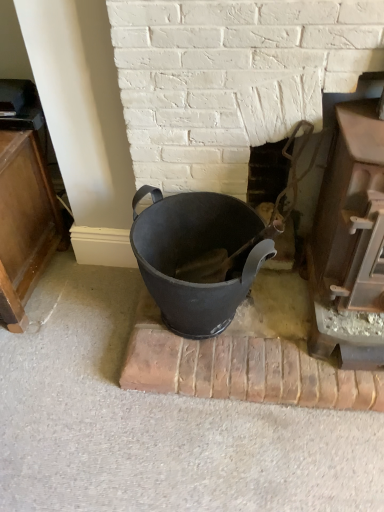
Question: Is smooth metal fireplace at center, marked as the second fireplace in a right-to-left arrangement, facing towards smooth brown wood at right, the 1th fireplace positioned from the right?

Choices:
 (A) no
 (B) yes

Answer: (A)

Question: From the image's perspective, is smooth metal fireplace at center, marked as the second fireplace in a right-to-left arrangement, under smooth brown wood at right, which ranks as the 3th fireplace in left-to-right order?

Choices:
 (A) no
 (B) yes

Answer: (A)

Question: Is smooth metal fireplace at center, marked as the second fireplace in a right-to-left arrangement, closer to the viewer compared to smooth brown wood at right, which ranks as the 3th fireplace in left-to-right order?

Choices:
 (A) yes
 (B) no

Answer: (B)

Question: Is smooth brown wood at right, which ranks as the 3th fireplace in left-to-right order, at the back of smooth metal fireplace at center, marked as the second fireplace in a right-to-left arrangement?

Choices:
 (A) yes
 (B) no

Answer: (B)

Question: From the image's perspective, does smooth metal fireplace at center, marked as the second fireplace in a left-to-right arrangement, appear higher than smooth brown wood at right, the 1th fireplace positioned from the right?

Choices:
 (A) yes
 (B) no

Answer: (A)

Question: From a real-world perspective, is smooth metal fireplace at center, marked as the second fireplace in a left-to-right arrangement, physically located above or below smooth brown wood at right, which ranks as the 3th fireplace in left-to-right order?

Choices:
 (A) above
 (B) below

Answer: (B)

Question: Considering the positions of smooth metal fireplace at center, marked as the second fireplace in a right-to-left arrangement, and smooth brown wood at right, which ranks as the 3th fireplace in left-to-right order, in the image, is smooth metal fireplace at center, marked as the second fireplace in a right-to-left arrangement, bigger or smaller than smooth brown wood at right, which ranks as the 3th fireplace in left-to-right order,?

Choices:
 (A) big
 (B) small

Answer: (B)

Question: Considering the positions of smooth metal fireplace at center, marked as the second fireplace in a left-to-right arrangement, and smooth brown wood at right, the 1th fireplace positioned from the right, in the image, is smooth metal fireplace at center, marked as the second fireplace in a left-to-right arrangement, taller or shorter than smooth brown wood at right, the 1th fireplace positioned from the right,?

Choices:
 (A) tall
 (B) short

Answer: (B)

Question: Do you think smooth metal fireplace at center, marked as the second fireplace in a right-to-left arrangement, is within smooth brown wood at right, which ranks as the 3th fireplace in left-to-right order, or outside of it?

Choices:
 (A) outside
 (B) inside

Answer: (A)

Question: Based on their positions, is smooth brown wood at right, the 1th fireplace positioned from the right, located to the left or right of matte black bucket at center?

Choices:
 (A) left
 (B) right

Answer: (B)

Question: Is smooth brown wood at right, which ranks as the 3th fireplace in left-to-right order, taller or shorter than matte black bucket at center?

Choices:
 (A) tall
 (B) short

Answer: (A)

Question: Considering the positions of point (370, 342) and point (182, 242), is point (370, 342) closer or farther from the camera than point (182, 242)?

Choices:
 (A) farther
 (B) closer

Answer: (B)

Question: From the image's perspective, relative to matte black bucket at center, is smooth brown wood at right, the 1th fireplace positioned from the right, above or below?

Choices:
 (A) above
 (B) below

Answer: (A)

Question: From the image's perspective, relative to smooth brown wood at right, the 1th fireplace positioned from the right, is matte black bucket at center above or below?

Choices:
 (A) below
 (B) above

Answer: (A)

Question: Is matte black bucket at center to the left or to the right of smooth brown wood at right, which ranks as the 3th fireplace in left-to-right order, in the image?

Choices:
 (A) left
 (B) right

Answer: (A)